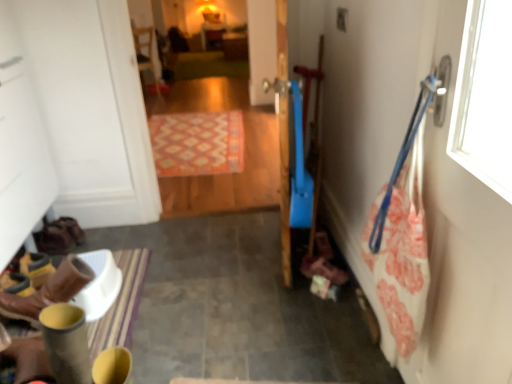
Identify the location of vacant space to the right of brown leather boots at lower left. The height and width of the screenshot is (384, 512). (147, 313).